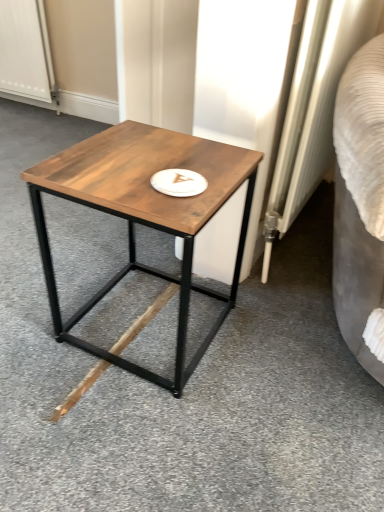
The width and height of the screenshot is (384, 512). What are the coordinates of `vacant space to the right of white matte platter at center` in the screenshot? It's located at (222, 181).